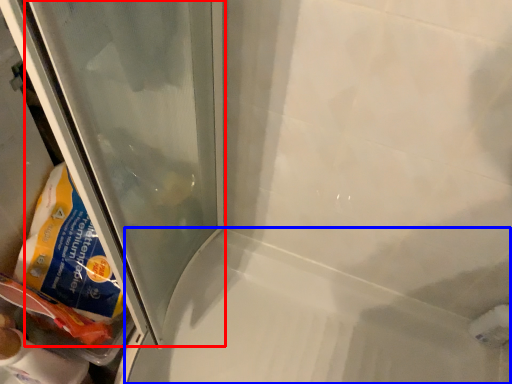
Question: Which object is further to the camera taking this photo, glass door (highlighted by a red box) or bath (highlighted by a blue box)?

Choices:
 (A) glass door
 (B) bath

Answer: (B)